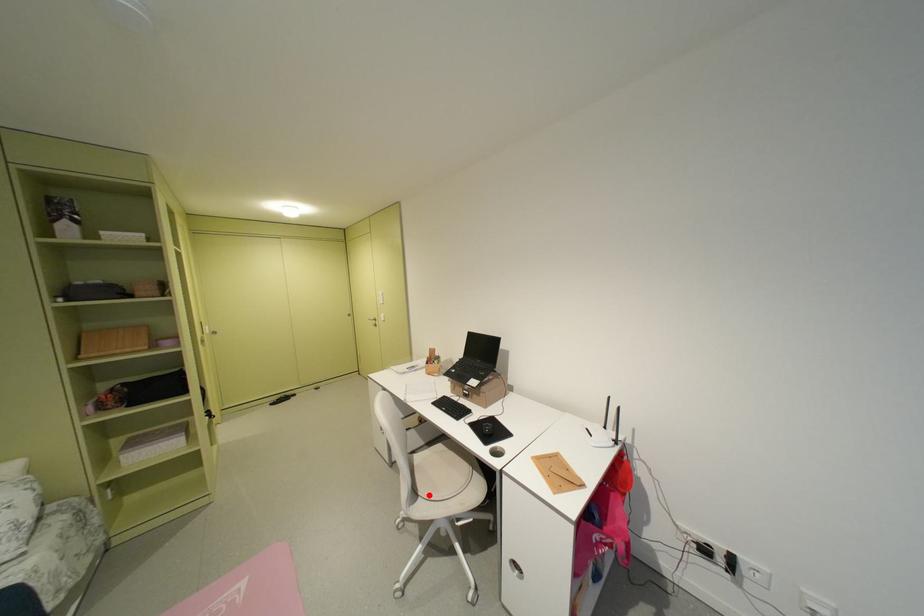
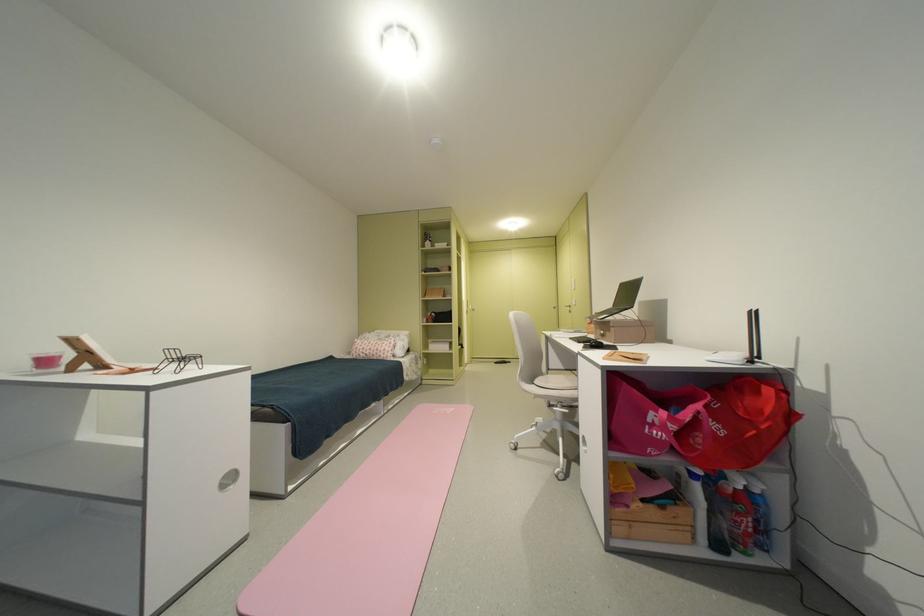
Question: I am providing you with two images of the same scene from different viewpoints. Image1 has a red point marked. In image2, the corresponding 3D location appears at what relative position? Reply with the corresponding letter.

Choices:
 (A) Closer
 (B) Farther

Answer: (B)